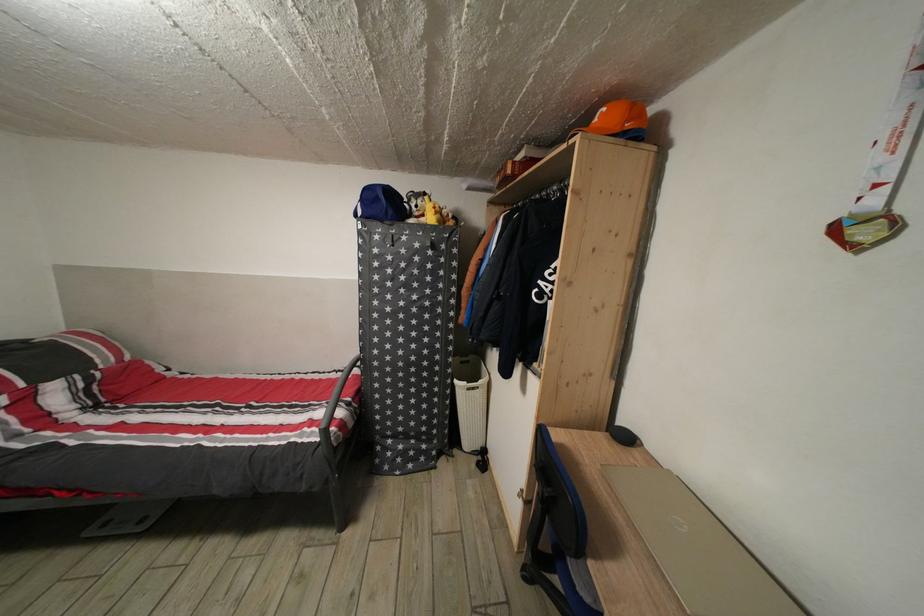
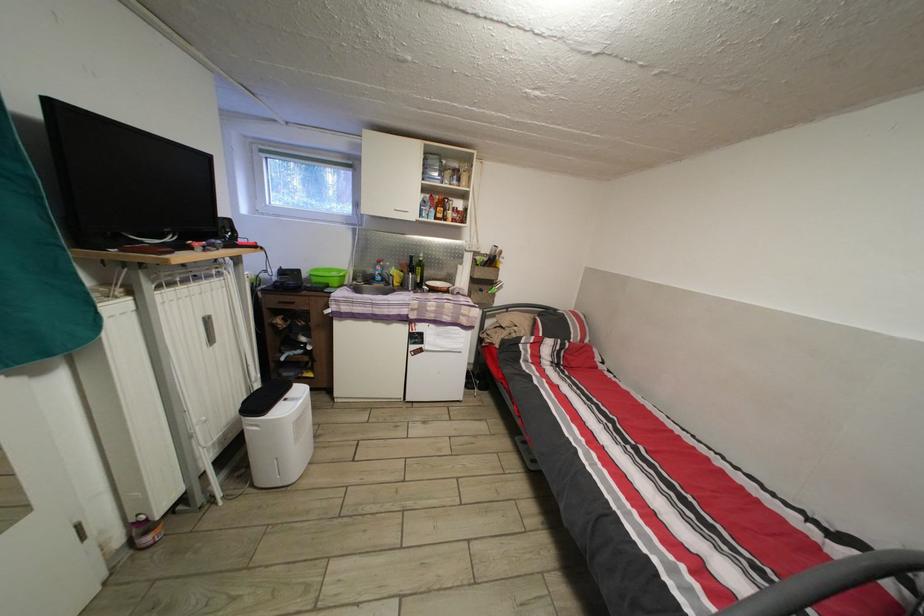
Question: The camera is either moving clockwise (left) or counter-clockwise (right) around the object. The first image is from the beginning of the video and the second image is from the end. Is the camera moving left or right when shooting the video?

Choices:
 (A) Left
 (B) Right

Answer: (B)